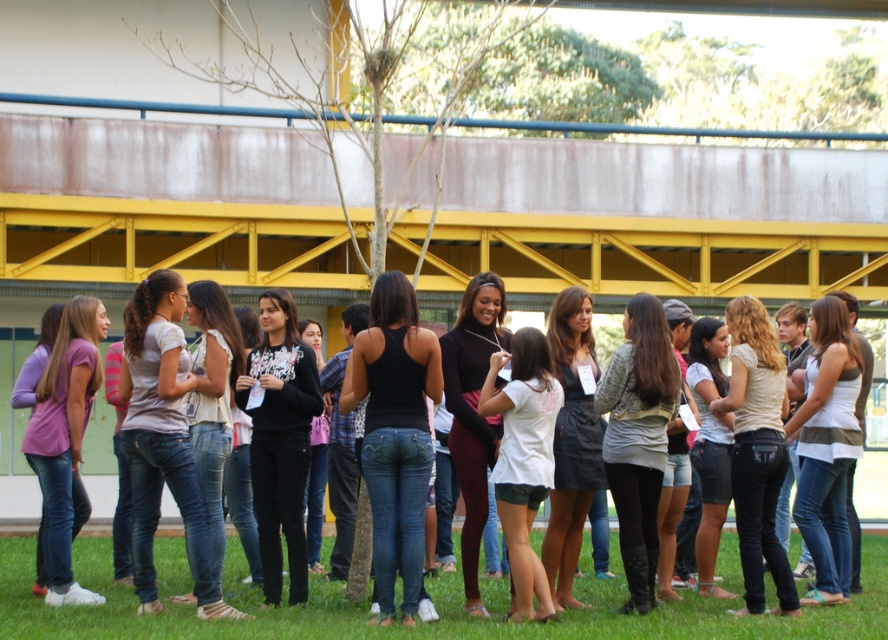
Based on the photo, you are standing at the origin point in the image. You see two points labeled as point (375,513) and point (720,333). Which point is closer to you?

Point (375,513) is in front of point (720,333), so it is closer to you.

You are organizing a clothing donation drive and need to categorize items based on their size. You have a matte white blouse at center and a white jersey at center. Which item should you place in the small size bin?

The matte white blouse at center should be placed in the small size bin since it has a smaller size compared to the white jersey at center.